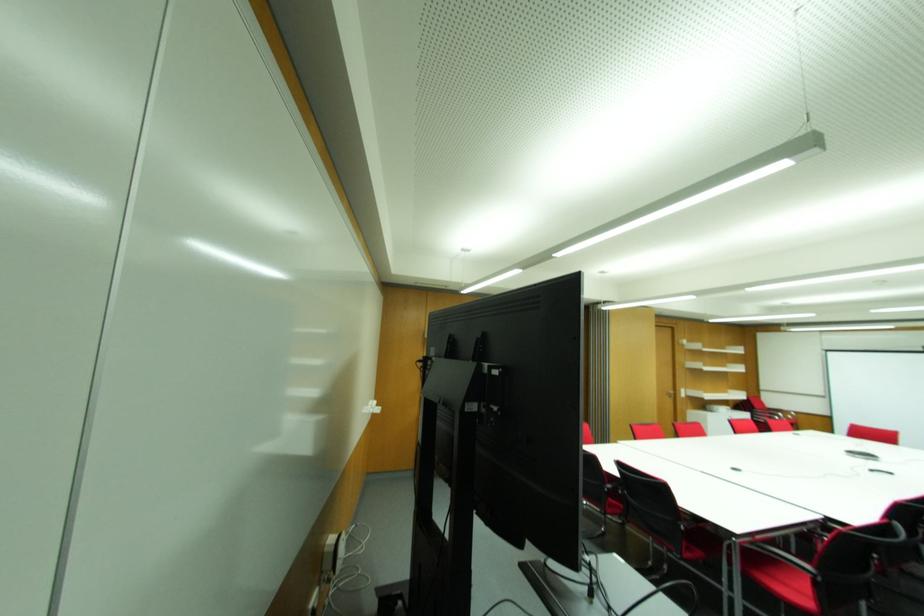
At what (x,y) coordinates should I click in order to perform the action: click on metal door handle. Please return your answer as a coordinate pair (x, y). This screenshot has width=924, height=616. Looking at the image, I should click on (670, 392).